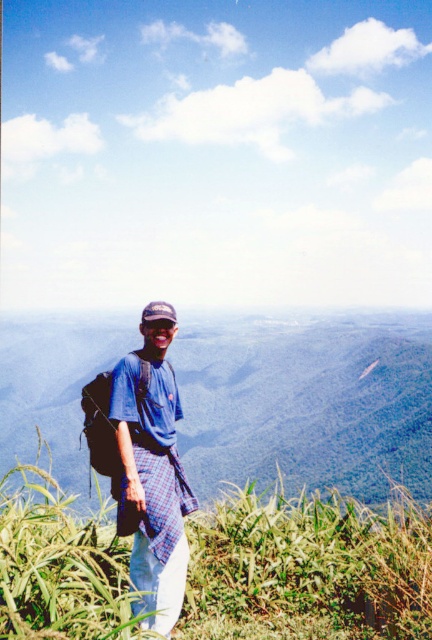
Between green leafy mountain at center and green grass at lower left, which one has less height?

green grass at lower left

Measure the distance between point (x=247, y=387) and camera.

36.40 meters

Where is `green leafy mountain at center`? This screenshot has width=432, height=640. green leafy mountain at center is located at coordinates (307, 401).

Between green leafy mountain at center and blue plaid shirt at center, which one is positioned lower?

green leafy mountain at center is below.

Who is positioned more to the right, green leafy mountain at center or blue plaid shirt at center?

green leafy mountain at center

Does point (13, 419) come closer to viewer compared to point (145, 493)?

No, it is behind (145, 493).

I want to click on green leafy mountain at center, so click(x=307, y=401).

Which is behind, point (386, 577) or point (162, 342)?

The point (162, 342) is more distant.

Between point (283, 547) and point (158, 524), which one is positioned in front?

Positioned in front is point (158, 524).

The width and height of the screenshot is (432, 640). Find the location of `green grass at lower left`. green grass at lower left is located at coordinates (308, 566).